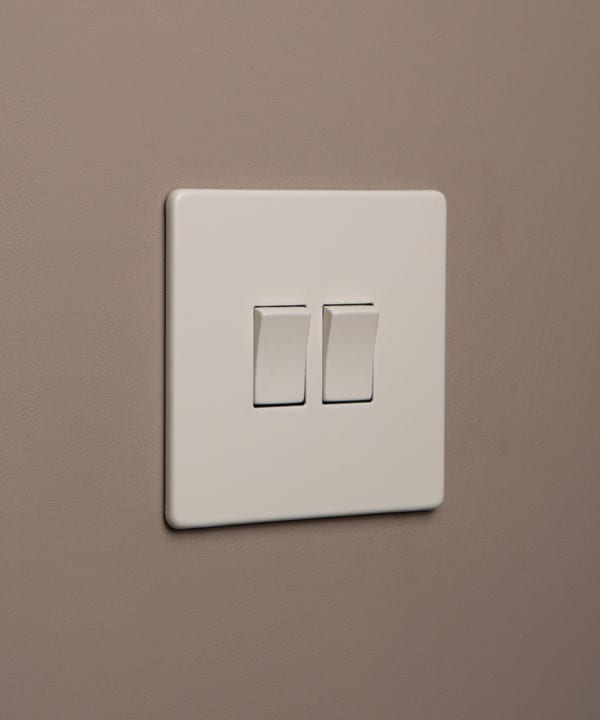
Where is `dark gray wall`? This screenshot has width=600, height=720. dark gray wall is located at coordinates (119, 647).